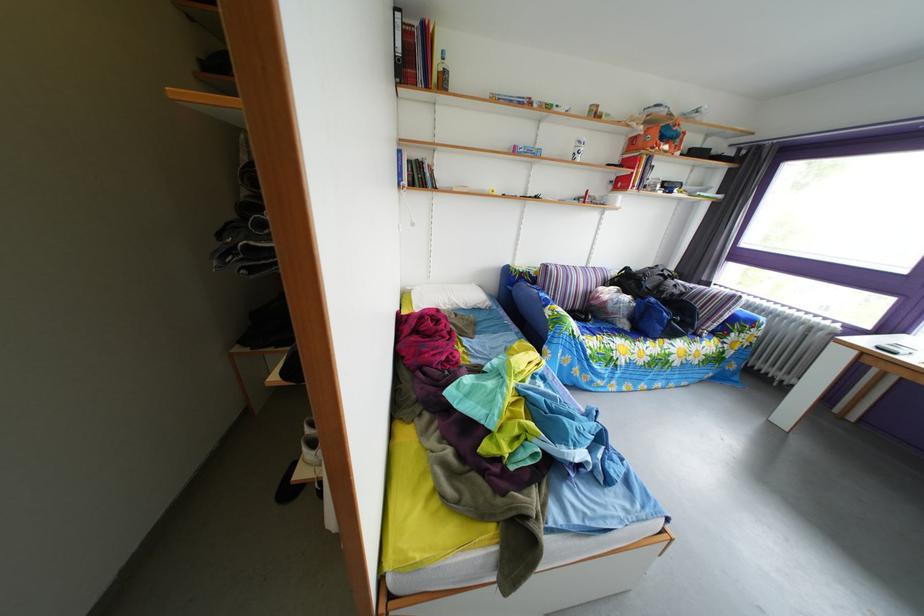
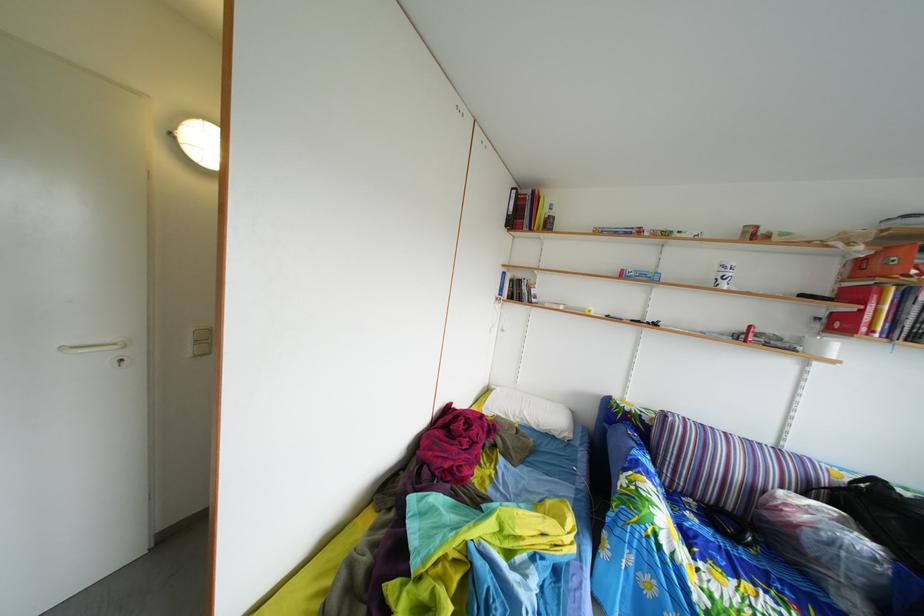
Find the pixel in the second image that matches point (477, 314) in the first image.

(549, 434)